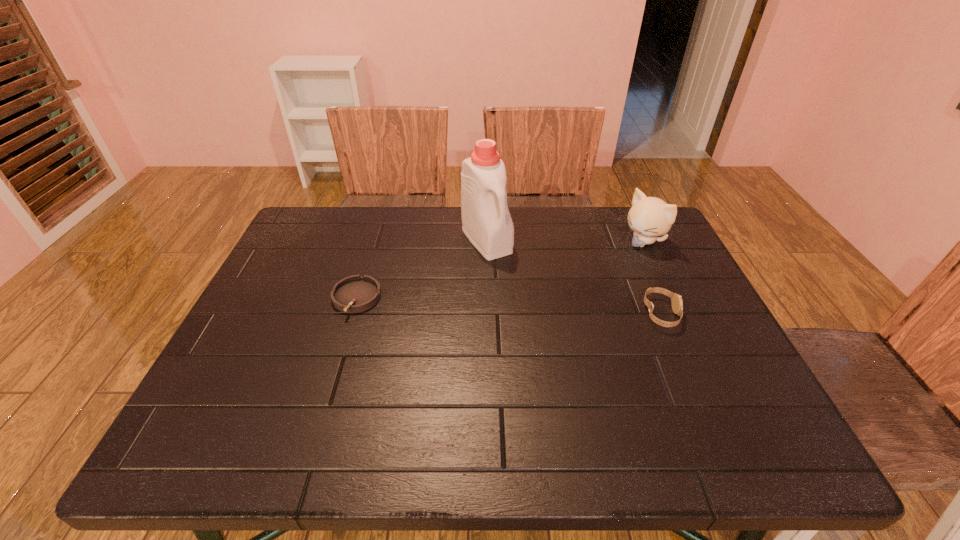
The width and height of the screenshot is (960, 540). Identify the location of vacant space situated 0.250m on the handle side of the detergent. 544,316.

I want to click on vacant space located on the face of the kitten, so click(x=606, y=267).

Where is `vacant space located on the face of the kitten`? The height and width of the screenshot is (540, 960). vacant space located on the face of the kitten is located at coordinates (594, 275).

Where is `free space located 0.260m on the face of the kitten`? This screenshot has height=540, width=960. free space located 0.260m on the face of the kitten is located at coordinates (573, 290).

Locate an element on the screen. This screenshot has width=960, height=540. detergent that is at the far edge is located at coordinates (487, 223).

You are a GUI agent. You are given a task and a screenshot of the screen. Output one action in this format:
    pyautogui.click(x=<x>, y=<y>)
    Task: Click on the kitten located in the far edge section of the desktop
    The height and width of the screenshot is (540, 960).
    Given the screenshot: What is the action you would take?
    pyautogui.click(x=649, y=217)

At what (x,y) coordinates should I click in order to perform the action: click on watch present at the right edge. Please return your answer as a coordinate pair (x, y). The width and height of the screenshot is (960, 540). Looking at the image, I should click on click(x=676, y=301).

What are the coordinates of `kitten present at the right edge` in the screenshot? It's located at (649, 217).

Locate an element on the screen. object that is at the far right corner is located at coordinates point(649,217).

Where is `free location at the far edge of the desktop`? The height and width of the screenshot is (540, 960). free location at the far edge of the desktop is located at coordinates (453, 246).